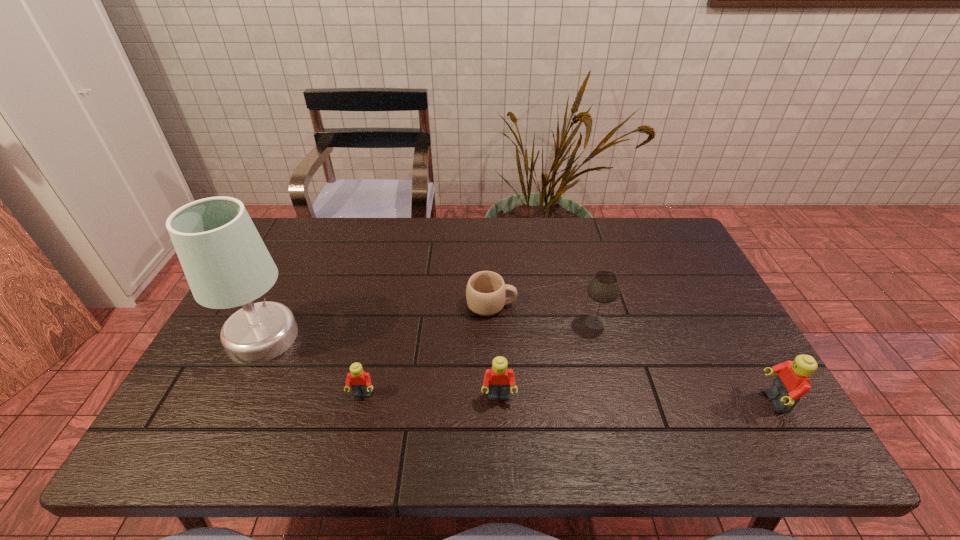
Identify the location of free space located 0.400m on the face of the tallest Lego. (585, 401).

Locate an element on the screen. free space located 0.060m on the face of the tallest Lego is located at coordinates (736, 401).

What are the coordinates of `vacant space located on the face of the tallest Lego` in the screenshot? It's located at (696, 401).

This screenshot has height=540, width=960. I want to click on vacant space situated on the side of the mug with the handle, so click(571, 305).

Find the location of `vacant point located on the base of the leftmost object`. vacant point located on the base of the leftmost object is located at coordinates (454, 337).

At what (x,y) coordinates should I click in order to perform the action: click on free spot located 0.340m on the left of the wineglass. Please return your answer as a coordinate pair (x, y). The image size is (960, 540). Looking at the image, I should click on (452, 322).

Locate an element on the screen. object located at the left edge is located at coordinates (226, 263).

This screenshot has width=960, height=540. I want to click on object located in the right edge section of the desktop, so click(792, 382).

I want to click on object that is at the near right corner, so click(x=792, y=382).

The height and width of the screenshot is (540, 960). I want to click on blank space at the far edge of the desktop, so click(620, 253).